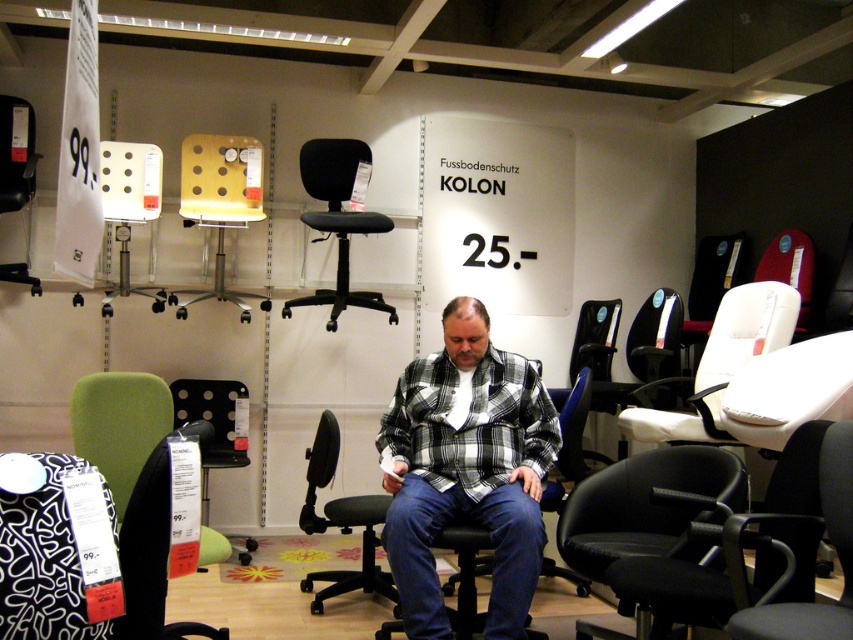
Which is below, plaid shirt at center or black fabric office chair at center?

plaid shirt at center is lower down.

Does plaid shirt at center have a greater height compared to black fabric office chair at center?

Correct, plaid shirt at center is much taller as black fabric office chair at center.

Is point (457, 420) in front of point (349, 145)?

Yes, point (457, 420) is closer to viewer.

You are a GUI agent. You are given a task and a screenshot of the screen. Output one action in this format:
    pyautogui.click(x=<x>, y=<y>)
    Task: Click on the plaid shirt at center
    The width and height of the screenshot is (853, 640).
    Given the screenshot: What is the action you would take?
    pyautogui.click(x=466, y=468)

Does plaid shirt at center appear on the left side of green fabric armchair at lower left?

No, plaid shirt at center is not to the left of green fabric armchair at lower left.

Can you confirm if plaid shirt at center is shorter than green fabric armchair at lower left?

No.

At what (x,y) coordinates should I click in order to perform the action: click on plaid shirt at center. Please return your answer as a coordinate pair (x, y). The image size is (853, 640). Looking at the image, I should click on (466, 468).

Can you confirm if green fabric armchair at lower left is positioned to the right of black fabric office chair at center?

Incorrect, green fabric armchair at lower left is not on the right side of black fabric office chair at center.

The height and width of the screenshot is (640, 853). Identify the location of green fabric armchair at lower left. (119, 424).

This screenshot has height=640, width=853. Identify the location of green fabric armchair at lower left. (119, 424).